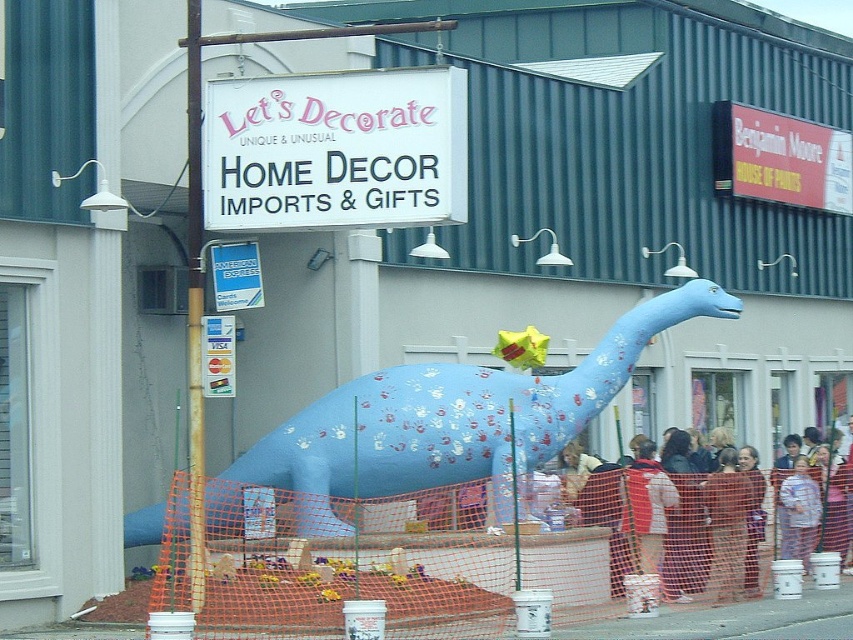
Who is more distant from viewer, (776, 195) or (807, 528)?

Point (776, 195)

Between red plastic sign at upper right and light brown fabric jacket at lower right, which one is positioned higher?

red plastic sign at upper right is above.

Is point (801, 147) farther from viewer compared to point (792, 477)?

That is True.

Where is `red plastic sign at upper right`? This screenshot has width=853, height=640. red plastic sign at upper right is located at coordinates (780, 157).

Does blue matte dinosaur at center have a lesser width compared to metallic credit card at center?

No, blue matte dinosaur at center is not thinner than metallic credit card at center.

Who is shorter, blue matte dinosaur at center or metallic credit card at center?

With less height is metallic credit card at center.

Is point (397, 426) positioned behind point (213, 340)?

Yes, point (397, 426) is farther from viewer.

Locate an element on the screen. Image resolution: width=853 pixels, height=640 pixels. blue matte dinosaur at center is located at coordinates (448, 420).

Is red plastic sign at upper right smaller than blue plastic sign at upper center?

No.

This screenshot has width=853, height=640. I want to click on red plastic sign at upper right, so click(780, 157).